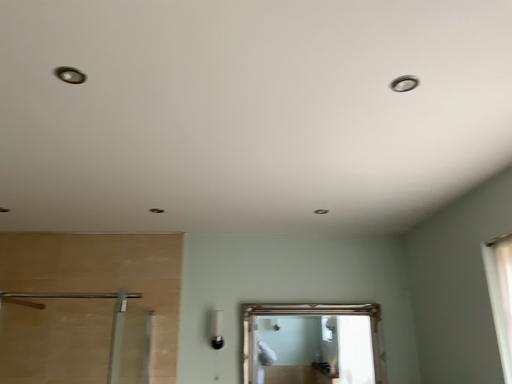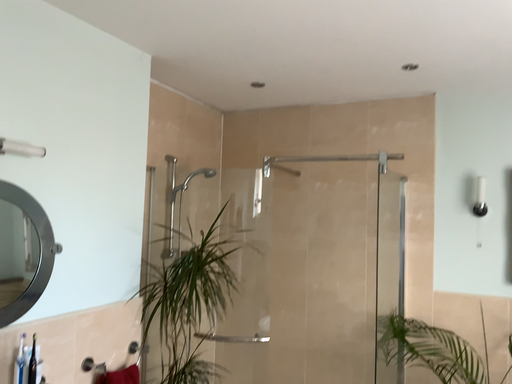
Question: Which way did the camera rotate in the video?

Choices:
 (A) rotated upward
 (B) rotated downward

Answer: (B)